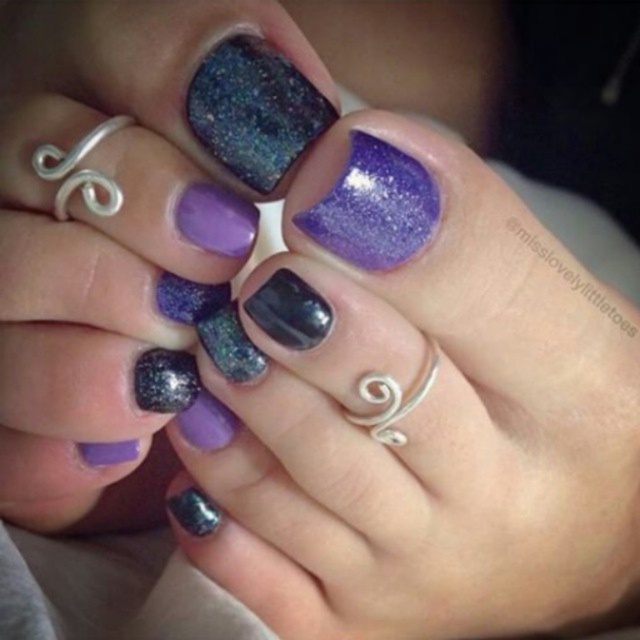
Question: Considering the relative positions of purple glitter nail at center and sparkly black nail polish at center in the image provided, where is purple glitter nail at center located with respect to sparkly black nail polish at center?

Choices:
 (A) above
 (B) below

Answer: (A)

Question: Is glittery metallic nail polish at center to the right of sparkly black nail polish at center from the viewer's perspective?

Choices:
 (A) no
 (B) yes

Answer: (A)

Question: Which of the following is the closest to the observer?

Choices:
 (A) (296, 228)
 (B) (205, 506)

Answer: (A)

Question: Which point is closer to the camera?

Choices:
 (A) purple glitter nail at center
 (B) glittery metallic nail polish at center
 (C) sparkly black nail polish at center

Answer: (A)

Question: Among these objects, which one is nearest to the camera?

Choices:
 (A) purple glitter nail at center
 (B) glittery metallic nail polish at center

Answer: (A)

Question: Is glittery metallic nail polish at center closer to the viewer compared to sparkly black nail polish at center?

Choices:
 (A) no
 (B) yes

Answer: (B)